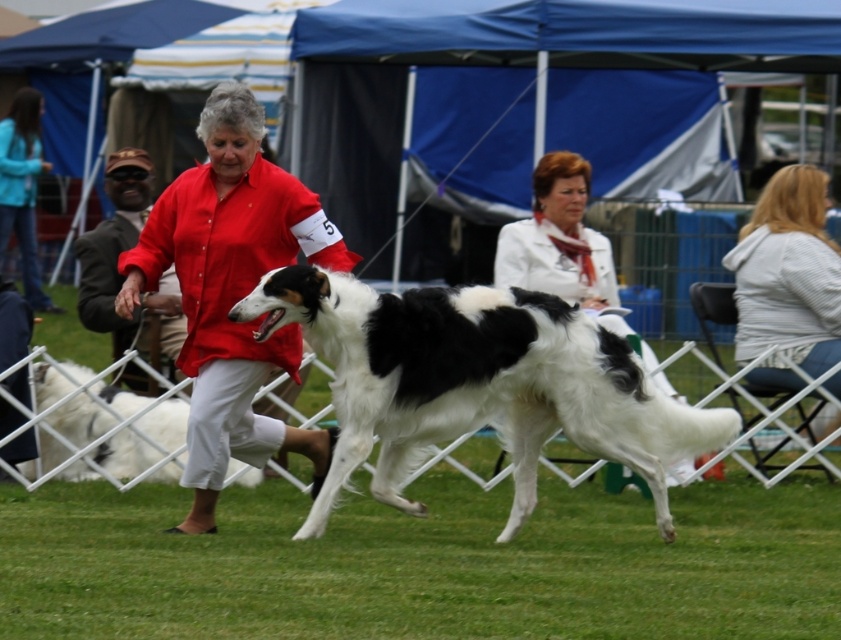
You are a photographer positioned at the origin point of the coordinate system. You need to capture a photo of the matte red shirt at center. What are the coordinates where you should aim your camera?

The coordinates to aim your camera are at point (231, 291).

You are standing at the center of the image. Which direction should you move to reach the light gray striped sweater at right?

The light gray striped sweater at right is located at point 0.438 on the x axis and 0.937 on the y axis. Since you are at the center, you should move to the right and slightly upward to reach it.

You are a photographer at the dog show. You want to take a photo of the matte red shirt at center and the matte teal jacket at upper left. Which object is positioned more towards the right side of the image?

The matte red shirt at center is positioned more towards the right side of the image compared to the matte teal jacket at upper left.